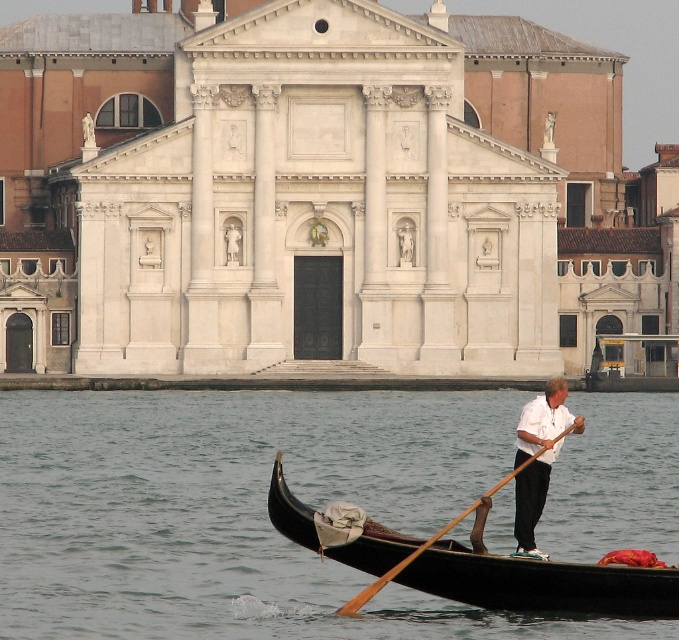
You are a tourist standing on the bridge overlooking the canal. You see the white cotton shirt at center and the brown wood paddle at lower center. How far apart are these two items in feet?

The distance between the white cotton shirt at center and the brown wood paddle at lower center is 18.70 feet.

Based on the photo, you are a tourist standing on a bridge overlooking the canal. You notice the transparent water at lower center and the white cotton shirt at center. Which object is closer to you, the tourist?

The transparent water at lower center is positioned under the white cotton shirt at center, meaning the white cotton shirt at center is higher up and thus closer to you as a tourist on the bridge.

You are standing on a bridge overlooking the gondola and the building. You want to take a photo that includes both the white cotton shirt at center and the brown wood paddle at lower center. Which object should you focus on first to ensure both are in frame?

You should focus on the white cotton shirt at center first because it is closer to you than the brown wood paddle at lower center, ensuring both will be in the frame when centered on the shirt.